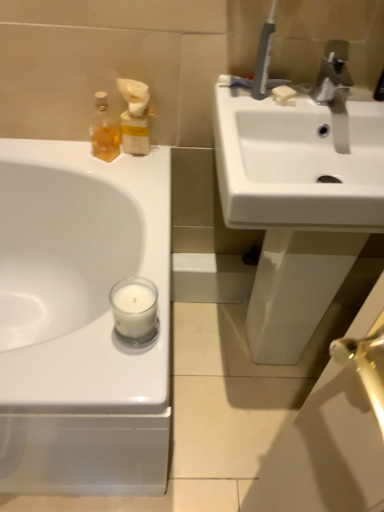
Where is `vacant space in front of translucent glass bottle at upper left`? The height and width of the screenshot is (512, 384). vacant space in front of translucent glass bottle at upper left is located at coordinates [x=119, y=180].